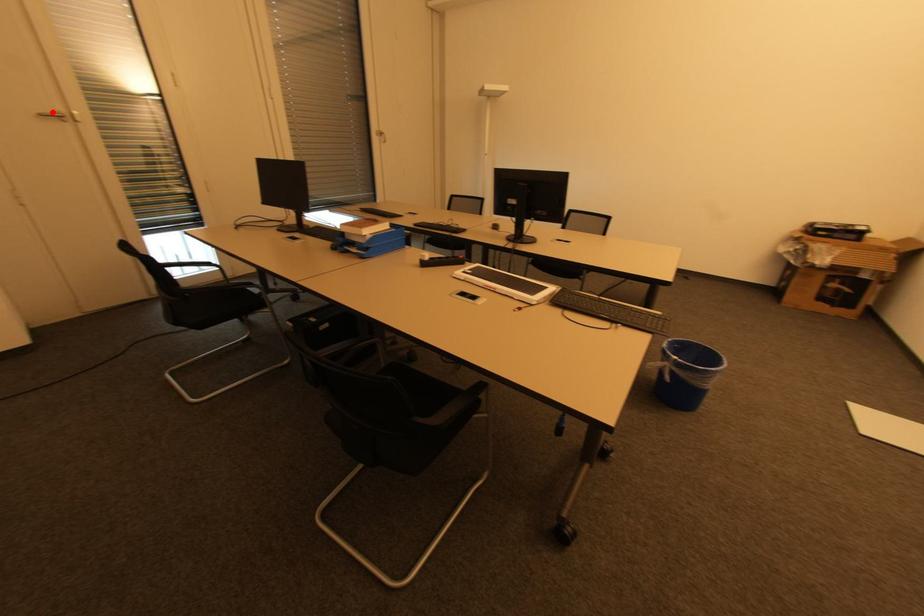
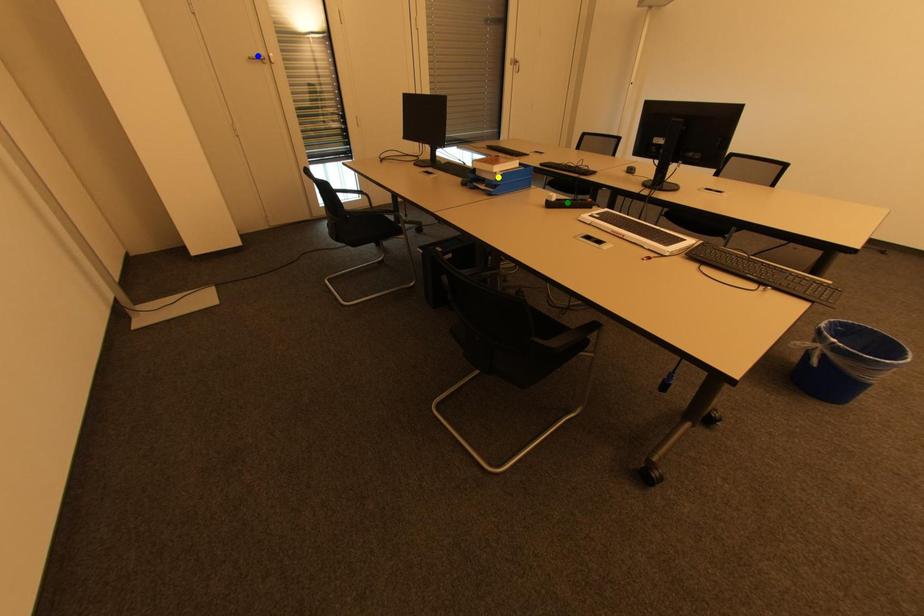
Question: I am providing you with two images of the same scene from different viewpoints. A red point is marked on the first image. You are given multiple points on the second image. Can you choose the point in image 2 that corresponds to the point in image 1?

Choices:
 (A) blue point
 (B) green point
 (C) yellow point

Answer: (A)